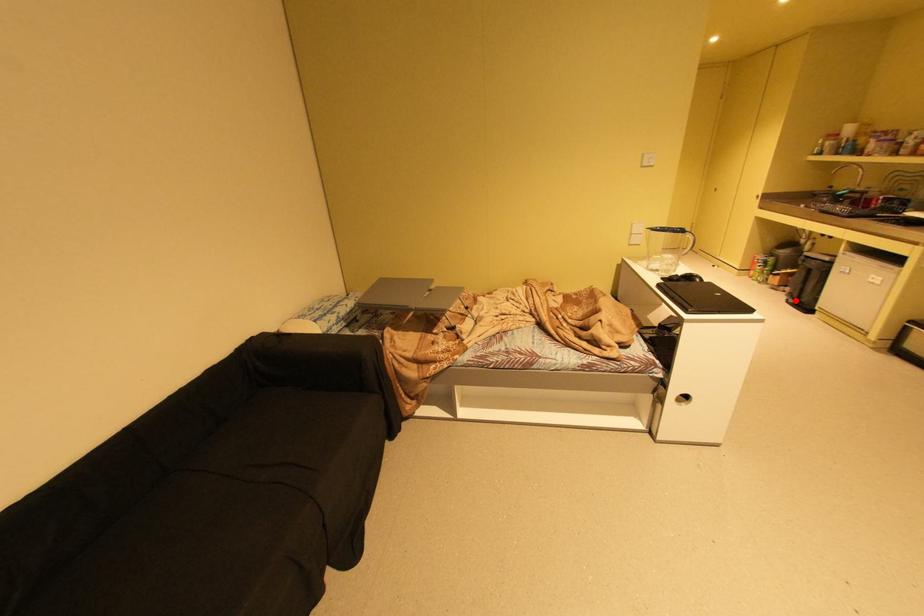
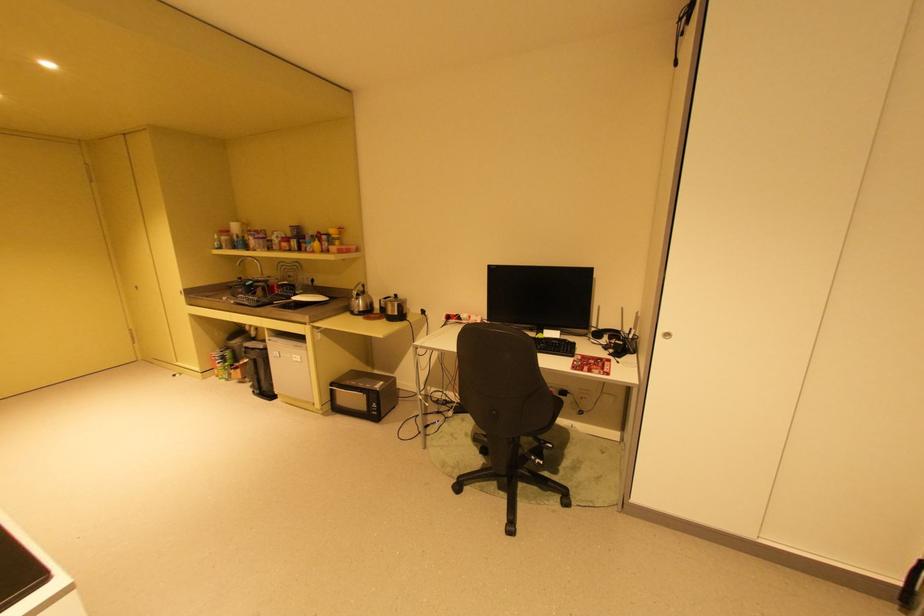
Where in the second image is the point corresponding to the highlighted location from the first image?

(261, 392)